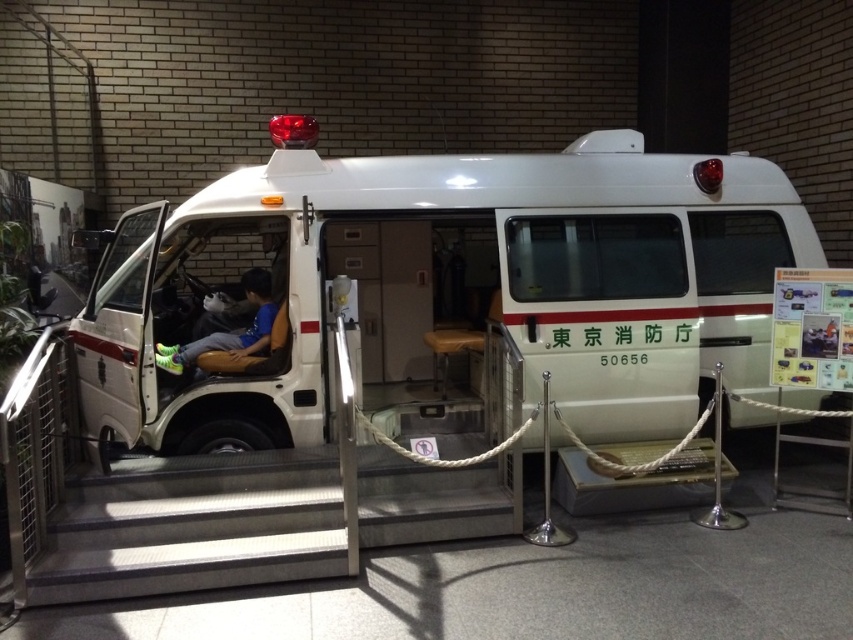
This screenshot has height=640, width=853. Describe the element at coordinates (195, 528) in the screenshot. I see `metallic silver stairs at center` at that location.

Is metallic silver stairs at center positioned in front of matte black sneakers at center?

Yes, metallic silver stairs at center is closer to the viewer.

Does point (196, 504) lie in front of point (256, 333)?

Yes, point (196, 504) is in front of point (256, 333).

The height and width of the screenshot is (640, 853). In order to click on metallic silver stairs at center in this screenshot , I will do `click(195, 528)`.

Does white glossy van at center appear over matte black sneakers at center?

Yes.

Describe the element at coordinates (454, 284) in the screenshot. I see `white glossy van at center` at that location.

Is point (672, 193) in front of point (262, 320)?

That is False.

Locate an element on the screen. This screenshot has height=640, width=853. white glossy van at center is located at coordinates (454, 284).

Which is more to the right, white glossy van at center or metallic silver stairs at center?

From the viewer's perspective, white glossy van at center appears more on the right side.

Is point (483, 296) positioned after point (149, 518)?

Yes, point (483, 296) is behind point (149, 518).

Find the location of a particular element. The image size is (853, 640). white glossy van at center is located at coordinates (454, 284).